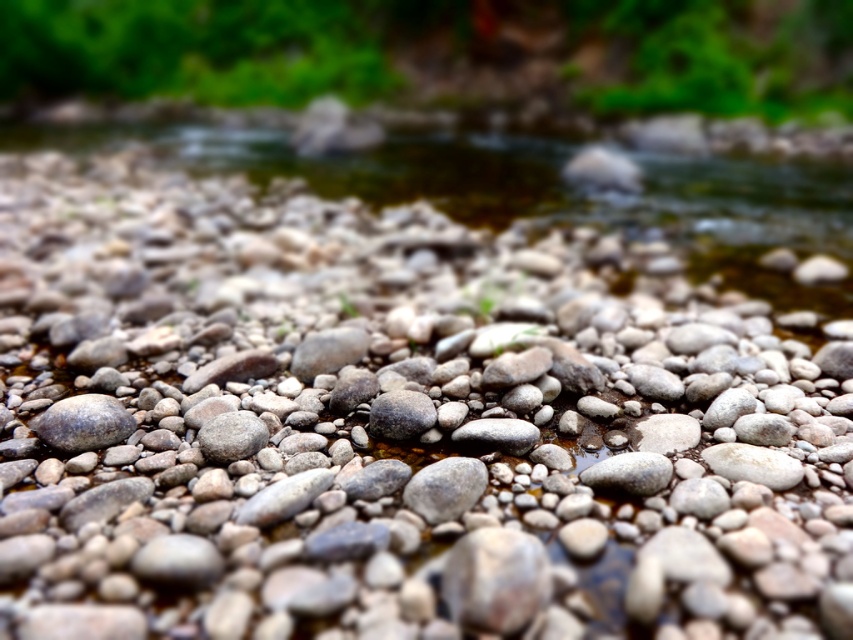
You are a geologist examining the riverbank. You have a tool that can only fit through spaces narrower than 10 cm. You need to place the tool between the smooth gray rock at center and the gray matte rock at center. Can you do it?

The smooth gray rock at center is thinner than the gray matte rock at center. Since the tool requires a space narrower than 10 cm, it depends on the exact thickness of the smooth gray rock. However, without specific measurements, we cannot confirm if the space between them is suitable. Please measure the thickness of the smooth gray rock to determine.

In the scene shown: You are a geologist examining the riverbank and notice two objects labeled smooth gray stone at center and smooth gray rock at center. Which of these two objects takes up more space in the image?

The smooth gray rock at center occupies more space than the smooth gray stone at center according to the description.